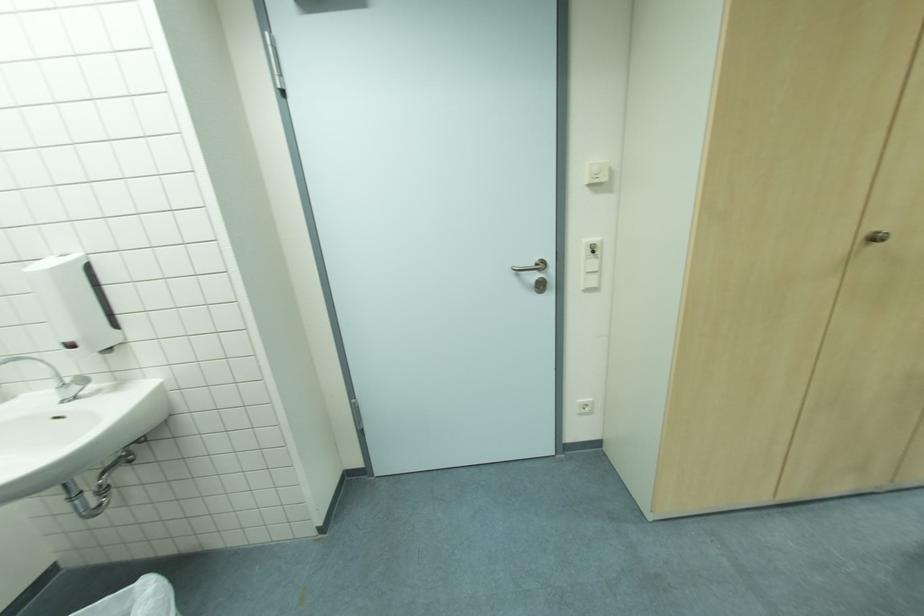
I want to click on soap dispenser lever, so click(x=71, y=339).